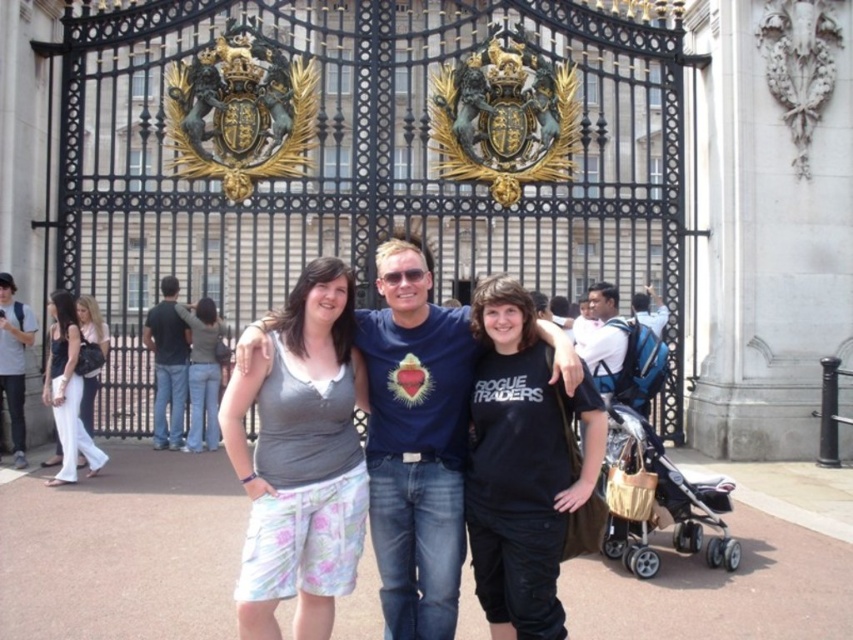
You are standing at the point marked as point (722,500) and want to take a photo of the ornate black gates with gold embellishments. The gates are 55.33 meters away from you. Can you fit the entire gates into your camera frame without moving? The camera has a standard 50mm lens with a 46 degree angle of view.

The ornate black gates are 55.33 meters away from point (722,500). With a 50mm lens and 46 degree angle of view, the camera can capture objects up to approximately 50 meters away within the frame. Since the gates are farther than this, you may need to move closer or use a wider lens to ensure the entire gates fit into the photo.

You are a photographer taking a picture of the beige fabric stroller at lower right and the matte white pants at left. Which object is closer to the camera?

The beige fabric stroller at lower right is closer to the camera because it is in front of the matte white pants at left.